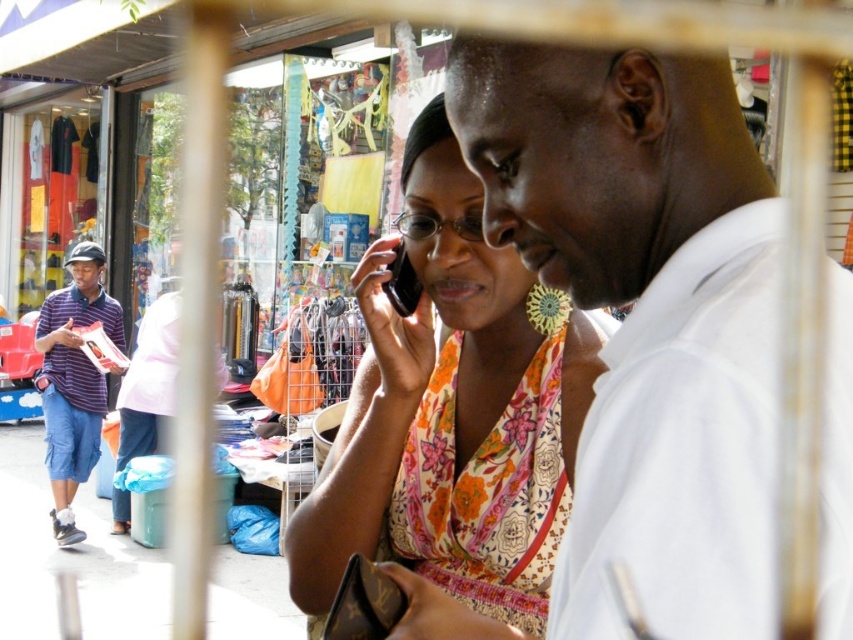
Question: Which of the following is the closest to the observer?

Choices:
 (A) (402, 307)
 (B) (93, 292)
 (C) (349, 493)

Answer: (C)

Question: Does striped polo shirt at left have a greater width compared to black plastic phone at center?

Choices:
 (A) yes
 (B) no

Answer: (A)

Question: Among these points, which one is farthest from the camera?

Choices:
 (A) (753, 579)
 (B) (378, 428)

Answer: (B)

Question: Does white cotton shirt at center appear over striped polo shirt at left?

Choices:
 (A) no
 (B) yes

Answer: (B)

Question: Is white cotton shirt at center further to camera compared to black plastic phone at center?

Choices:
 (A) yes
 (B) no

Answer: (B)

Question: Which object appears farthest from the camera in this image?

Choices:
 (A) black plastic phone at center
 (B) white cotton shirt at center
 (C) striped polo shirt at left

Answer: (C)